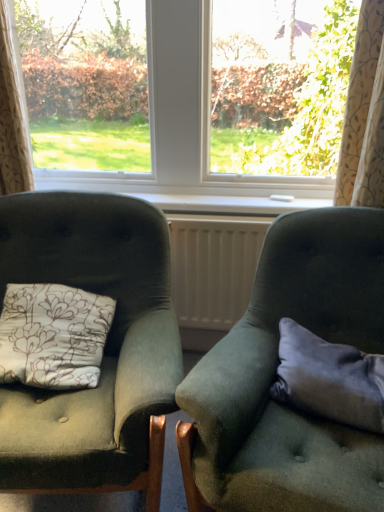
Question: Is the position of velvet green armchair at right, arranged as the first chair when viewed from the right, more distant than that of gray fabric pillow at right?

Choices:
 (A) yes
 (B) no

Answer: (B)

Question: Does velvet green armchair at right, arranged as the first chair when viewed from the right, turn towards gray fabric pillow at right?

Choices:
 (A) no
 (B) yes

Answer: (B)

Question: From a real-world perspective, is velvet green armchair at right, acting as the 2th chair starting from the left, below gray fabric pillow at right?

Choices:
 (A) no
 (B) yes

Answer: (B)

Question: Is velvet green armchair at right, acting as the 2th chair starting from the left, closer to the viewer compared to gray fabric pillow at right?

Choices:
 (A) no
 (B) yes

Answer: (B)

Question: Is velvet green armchair at right, acting as the 2th chair starting from the left, positioned beyond the bounds of gray fabric pillow at right?

Choices:
 (A) yes
 (B) no

Answer: (A)

Question: Is point (360, 67) positioned closer to the camera than point (297, 397)?

Choices:
 (A) closer
 (B) farther

Answer: (B)

Question: From a real-world perspective, is beige floral fabric curtain at upper right, which ranks as the 2th curtain in left-to-right order, positioned above or below gray fabric pillow at right?

Choices:
 (A) above
 (B) below

Answer: (A)

Question: Based on their sizes in the image, would you say beige floral fabric curtain at upper right, which ranks as the 2th curtain in left-to-right order, is bigger or smaller than gray fabric pillow at right?

Choices:
 (A) small
 (B) big

Answer: (B)

Question: In terms of height, does beige floral fabric curtain at upper right, acting as the 1th curtain starting from the right, look taller or shorter compared to gray fabric pillow at right?

Choices:
 (A) tall
 (B) short

Answer: (A)

Question: Considering the positions of point (87, 173) and point (211, 322), is point (87, 173) closer or farther from the camera than point (211, 322)?

Choices:
 (A) farther
 (B) closer

Answer: (A)

Question: Is transparent glass window at center in front of or behind white plastic radiator at center in the image?

Choices:
 (A) front
 (B) behind

Answer: (A)

Question: Is transparent glass window at center inside or outside of white plastic radiator at center?

Choices:
 (A) inside
 (B) outside

Answer: (B)

Question: Based on their sizes in the image, would you say transparent glass window at center is bigger or smaller than white plastic radiator at center?

Choices:
 (A) big
 (B) small

Answer: (A)

Question: Does point (0, 86) appear closer or farther from the camera than point (125, 251)?

Choices:
 (A) farther
 (B) closer

Answer: (A)

Question: From the image's perspective, is floral fabric curtain at left, positioned as the second curtain in right-to-left order, positioned above or below velvet green armchair at left, the first chair when ordered from left to right?

Choices:
 (A) below
 (B) above

Answer: (B)